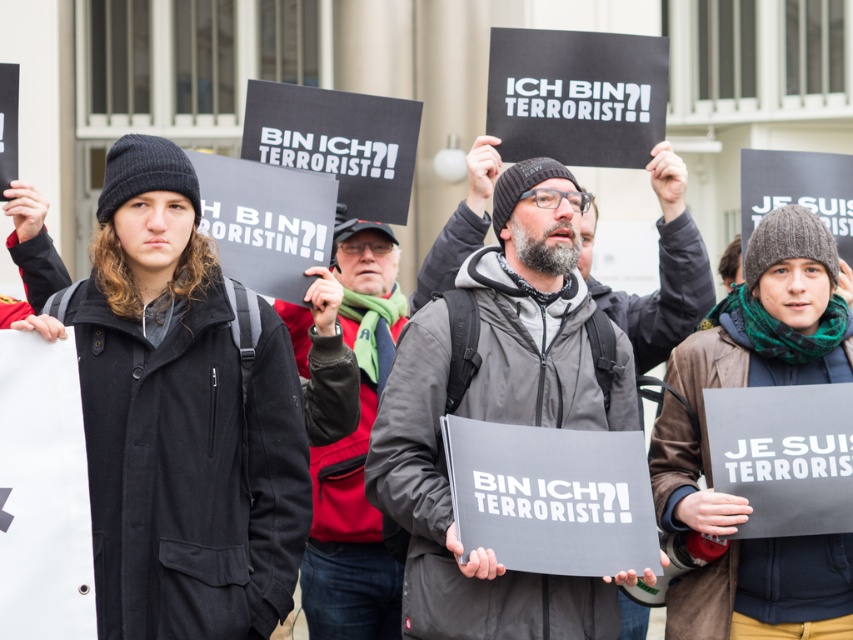
Question: Is gray fabric jacket at center to the left of matte black jacket at center from the viewer's perspective?

Choices:
 (A) yes
 (B) no

Answer: (B)

Question: Is gray fabric jacket at center positioned at the back of matte black jacket at center?

Choices:
 (A) no
 (B) yes

Answer: (A)

Question: Which of the following is the closest to the observer?

Choices:
 (A) gray fabric jacket at center
 (B) matte black jacket at center

Answer: (A)

Question: Which point is closer to the camera?

Choices:
 (A) (550, 387)
 (B) (381, 332)

Answer: (A)

Question: Can you confirm if gray fabric jacket at center is thinner than matte black jacket at center?

Choices:
 (A) no
 (B) yes

Answer: (A)